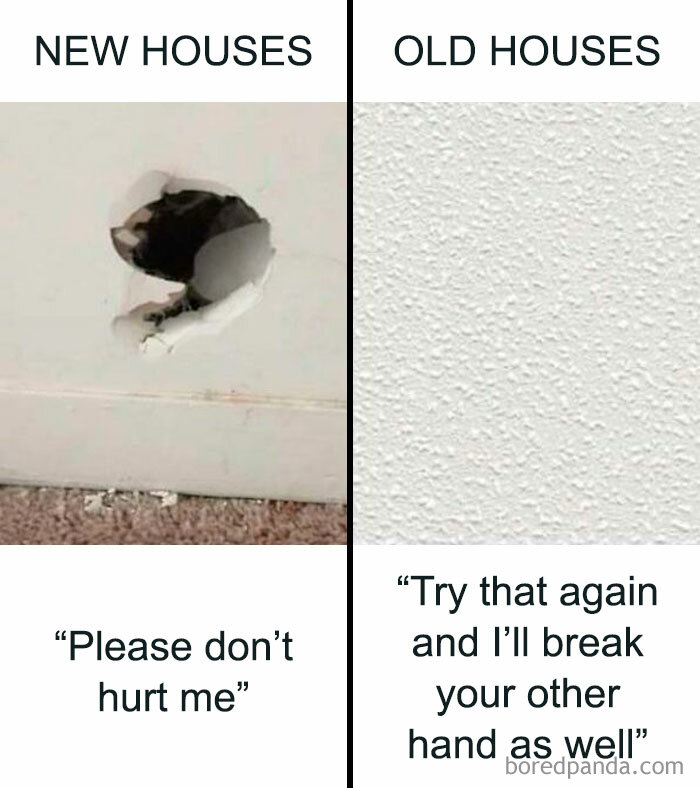
This screenshot has height=788, width=700. What are the coordinates of `drywall pieces` in the screenshot? It's located at (173, 497), (92, 500), (108, 489), (160, 492).